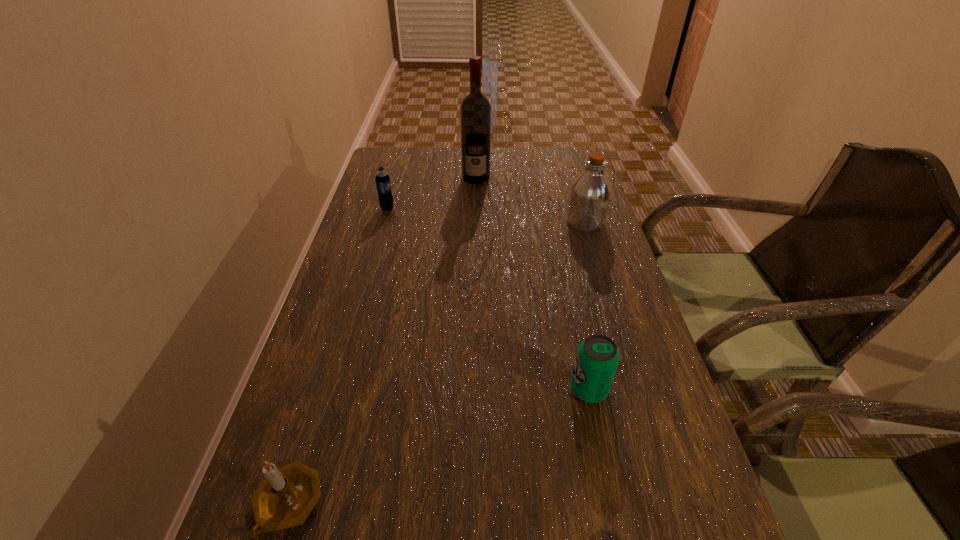
This screenshot has width=960, height=540. I want to click on vacant space located on the front-facing side of the second object from right to left, so click(493, 389).

Where is `vacant space situated on the front-facing side of the second object from right to left`? This screenshot has height=540, width=960. vacant space situated on the front-facing side of the second object from right to left is located at coordinates (458, 389).

Locate an element on the screen. This screenshot has width=960, height=540. free space located 0.160m on the front-facing side of the second object from right to left is located at coordinates (489, 389).

Locate an element on the screen. object positioned at the far edge is located at coordinates (475, 111).

At what (x,y) coordinates should I click in order to perform the action: click on object present at the left edge. Please return your answer as a coordinate pair (x, y). This screenshot has height=540, width=960. Looking at the image, I should click on (382, 179).

This screenshot has width=960, height=540. In order to click on bottle that is at the right edge in this screenshot , I will do `click(590, 193)`.

Where is `pop soda that is at the right edge`? Image resolution: width=960 pixels, height=540 pixels. pop soda that is at the right edge is located at coordinates (597, 358).

In the image, there is a desktop. Where is `free space at the far edge`? The height and width of the screenshot is (540, 960). free space at the far edge is located at coordinates (540, 171).

Locate an element on the screen. vacant area at the left edge of the desktop is located at coordinates (381, 224).

Locate an element on the screen. The width and height of the screenshot is (960, 540). free space at the right edge of the desktop is located at coordinates (636, 300).